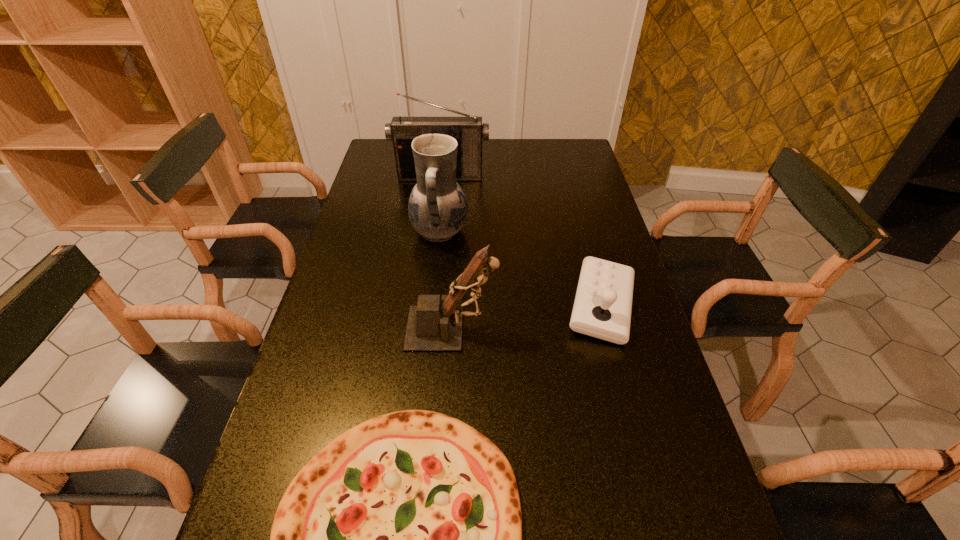
You are a GUI agent. You are given a task and a screenshot of the screen. Output one action in this format:
    pyautogui.click(x=<x>, y=<y>)
    Task: Click on the free area in between the figurine and the fourth nearest object
    The height and width of the screenshot is (540, 960).
    Given the screenshot: What is the action you would take?
    pyautogui.click(x=446, y=280)

Locate an element on the screen. This screenshot has width=960, height=540. vacant region between the pitcher and the figurine is located at coordinates (446, 280).

The image size is (960, 540). In order to click on vacant area between the radio receiver and the fourth tallest object in this screenshot , I will do `click(521, 241)`.

Identify the location of object that is the closest to the figurine. Image resolution: width=960 pixels, height=540 pixels. (401, 539).

Where is `object that is the third closest to the pitcher`? object that is the third closest to the pitcher is located at coordinates (602, 308).

You are a GUI agent. You are given a task and a screenshot of the screen. Output one action in this format:
    pyautogui.click(x=<x>, y=<y>)
    Task: Click on the free space that satisfies the following two spatial constraints: 1. on the front-facing side of the second shortest object; 2. on the right side of the fourth nearest object
    This screenshot has height=540, width=960.
    Given the screenshot: What is the action you would take?
    pyautogui.click(x=432, y=306)

Find the location of a particular element. The image size is (960, 540). free spot that satisfies the following two spatial constraints: 1. on the front-facing side of the second shortest object; 2. on the left side of the second farthest object is located at coordinates (432, 306).

Locate an element on the screen. Image resolution: width=960 pixels, height=540 pixels. vacant space that satisfies the following two spatial constraints: 1. on the front-facing side of the fourth tallest object; 2. on the left side of the pitcher is located at coordinates (432, 306).

The image size is (960, 540). Identify the location of free space that satisfies the following two spatial constraints: 1. on the front-facing side of the pitcher; 2. on the right side of the rightmost object. (432, 306).